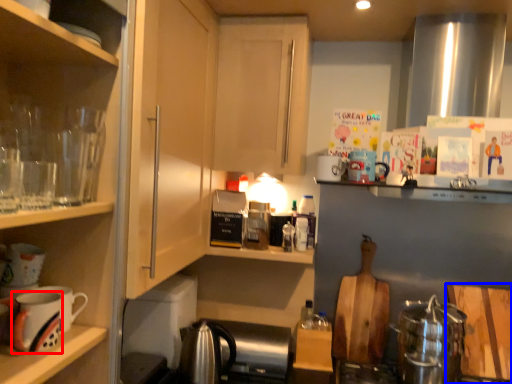
Question: Among these objects, which one is farthest to the camera, mug (highlighted by a red box) or cutting board (highlighted by a blue box)?

Choices:
 (A) mug
 (B) cutting board

Answer: (B)